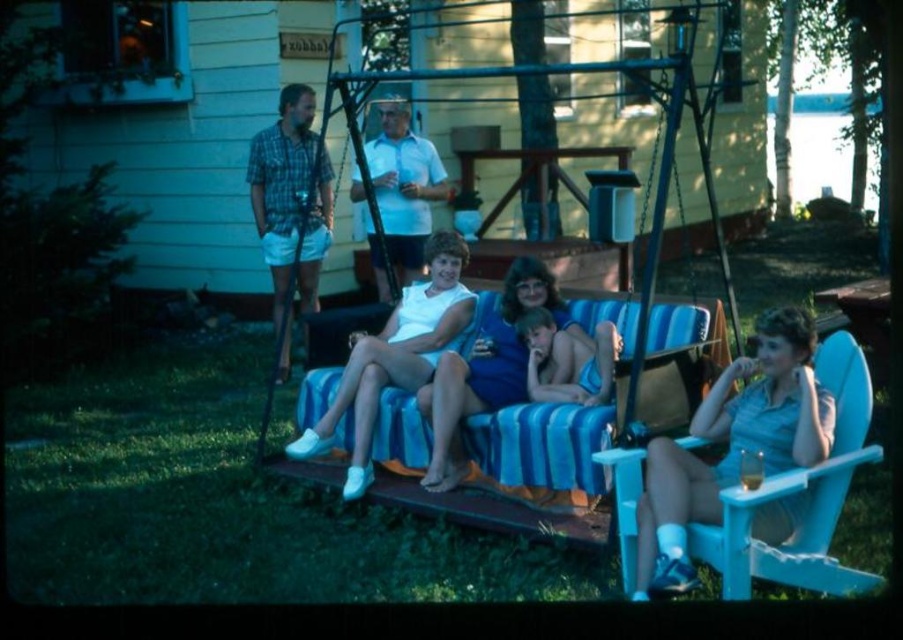
Does light blue plastic chair at right have a lesser width compared to blue fabric shorts at center?

Incorrect, light blue plastic chair at right's width is not less than blue fabric shorts at center's.

Does point (686, 538) lie in front of point (538, 374)?

That is True.

Which is behind, point (736, 461) or point (554, 323)?

Positioned behind is point (554, 323).

The image size is (903, 640). I want to click on light blue plastic chair at right, so click(x=732, y=445).

Does white matte swimsuit at center have a greater height compared to plaid shirt at left?

No.

In the scene shown: Does white matte swimsuit at center have a larger size compared to plaid shirt at left?

Yes.

What do you see at coordinates (396, 355) in the screenshot? I see `white matte swimsuit at center` at bounding box center [396, 355].

The height and width of the screenshot is (640, 903). Identify the location of white matte swimsuit at center. (396, 355).

From the picture: Is white matte swimsuit at center taller than matte blue dress at center?

Indeed, white matte swimsuit at center has a greater height compared to matte blue dress at center.

Is point (313, 452) behind point (543, 298)?

That is False.

At what (x,y) coordinates should I click in order to perform the action: click on white matte swimsuit at center. Please return your answer as a coordinate pair (x, y). This screenshot has width=903, height=640. Looking at the image, I should click on (396, 355).

Locate an element on the screen. white matte swimsuit at center is located at coordinates (396, 355).